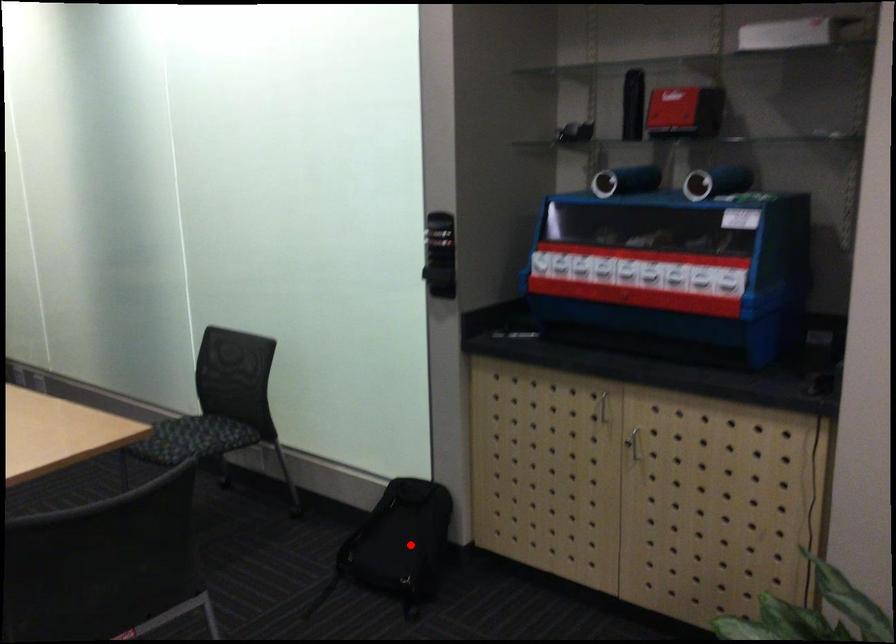
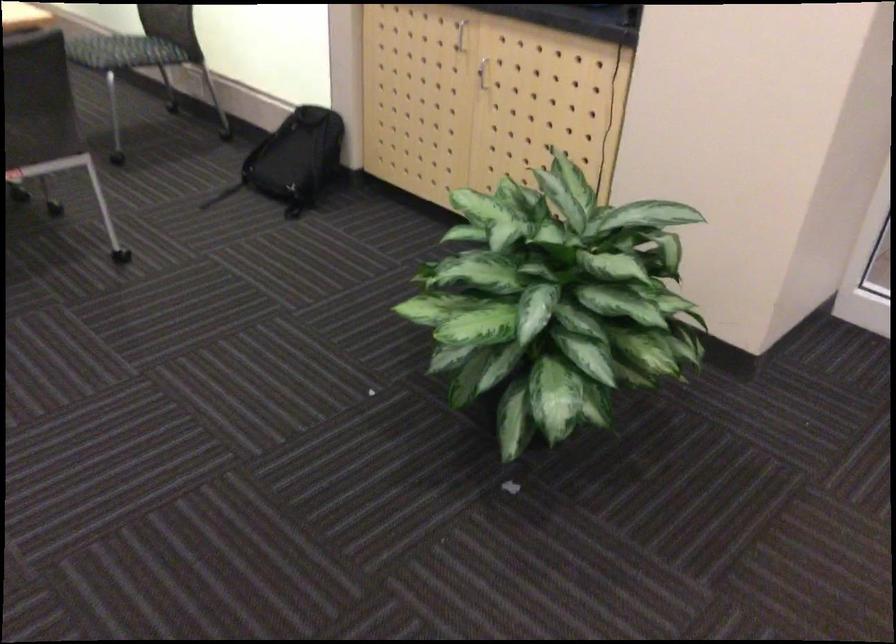
The point at the highlighted location is marked in the first image. Where is the corresponding point in the second image?

(293, 160)